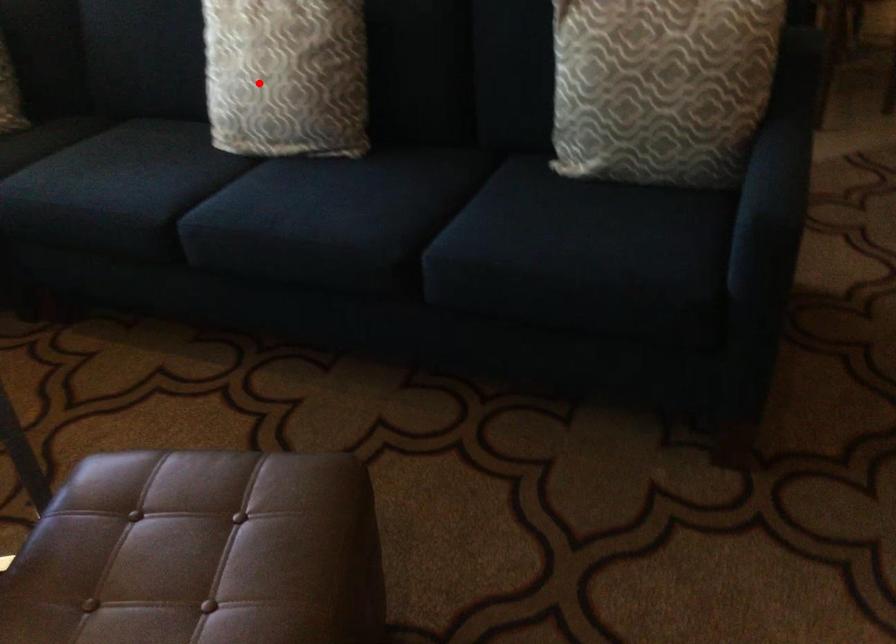
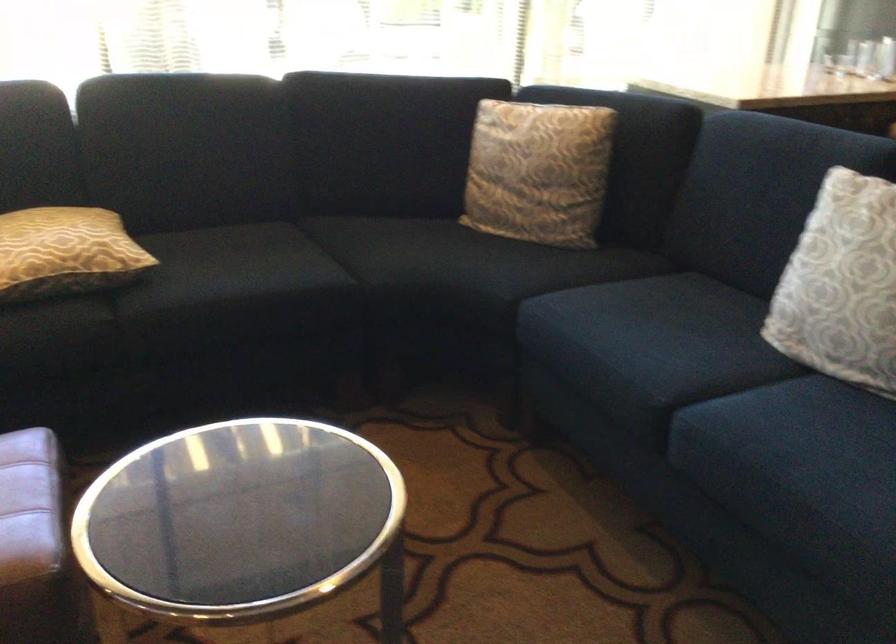
Find the pixel in the second image that matches the highlighted location in the first image.

(841, 285)